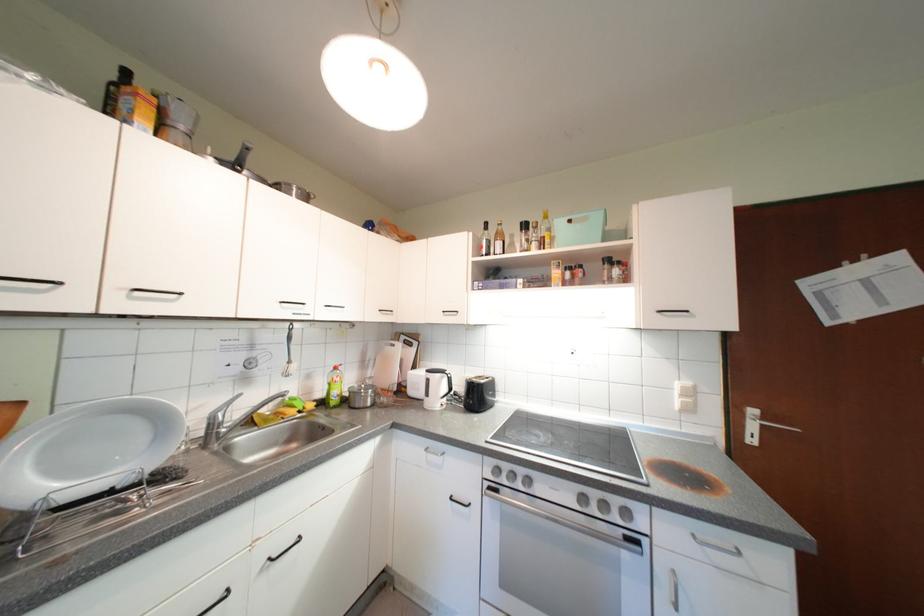
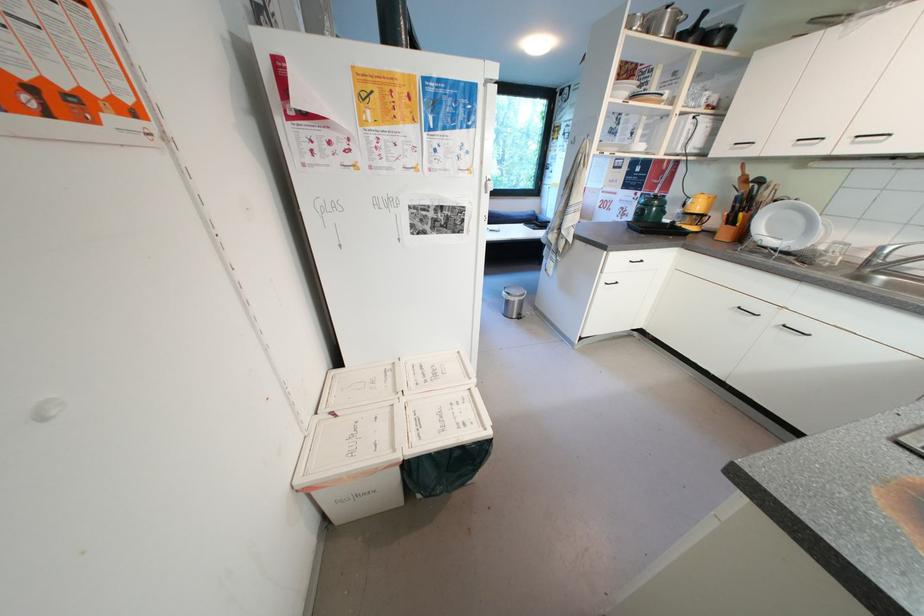
Locate, in the second image, the point that corresponds to pixel 222 428 in the first image.

(883, 257)